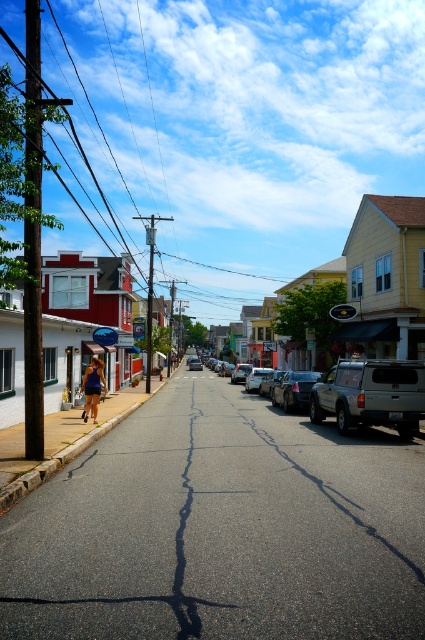
Between silver metallic suv at center-right and metallic silver car at center, which one appears on the right side from the viewer's perspective?

Positioned to the right is silver metallic suv at center-right.

Consider the image. Does silver metallic suv at center-right appear on the right side of metallic silver car at center?

Correct, you'll find silver metallic suv at center-right to the right of metallic silver car at center.

Does point (391, 406) lie behind point (311, 374)?

No, (391, 406) is in front of (311, 374).

Identify the location of silver metallic suv at center-right. This screenshot has width=425, height=640. (371, 394).

Does point (302, 378) come farther from viewer compared to point (87, 404)?

Yes, it is.

Looking at this image, is metallic silver car at center positioned before matte blue shorts at center?

No, it is behind matte blue shorts at center.

Locate an element on the screen. metallic silver car at center is located at coordinates (294, 388).

You are a GUI agent. You are given a task and a screenshot of the screen. Output one action in this format:
    pyautogui.click(x=<x>, y=<y>)
    Task: Click on the metallic silver car at center
    
    Given the screenshot: What is the action you would take?
    pyautogui.click(x=294, y=388)

Is point (297, 388) less distant than point (303, 406)?

Yes, point (297, 388) is closer to viewer.

Is silver metallic suv at center to the right of metallic silver car at center from the viewer's perspective?

Correct, you'll find silver metallic suv at center to the right of metallic silver car at center.

Which is behind, point (326, 403) or point (300, 401)?

The point (300, 401) is behind.

Locate an element on the screen. Image resolution: width=425 pixels, height=640 pixels. silver metallic suv at center is located at coordinates (360, 394).